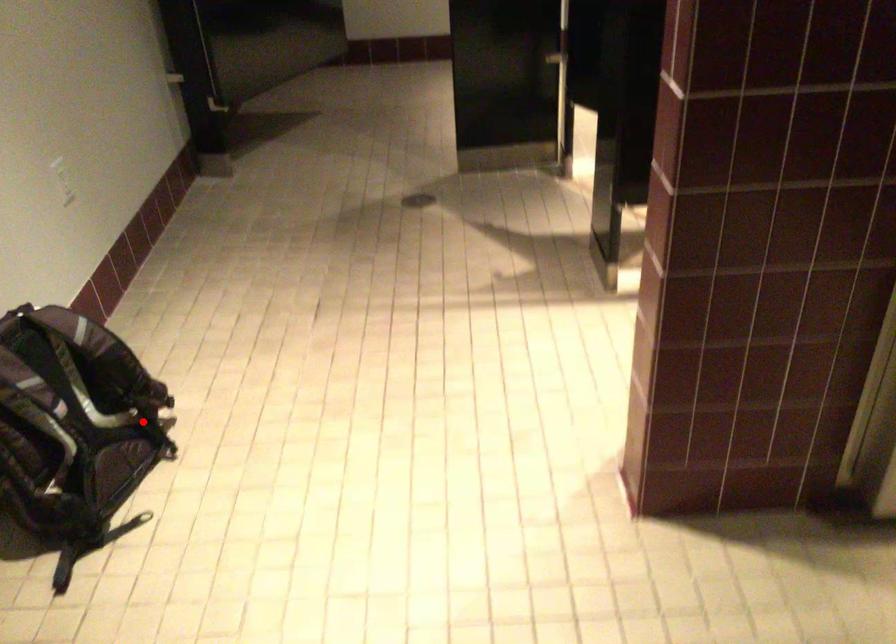
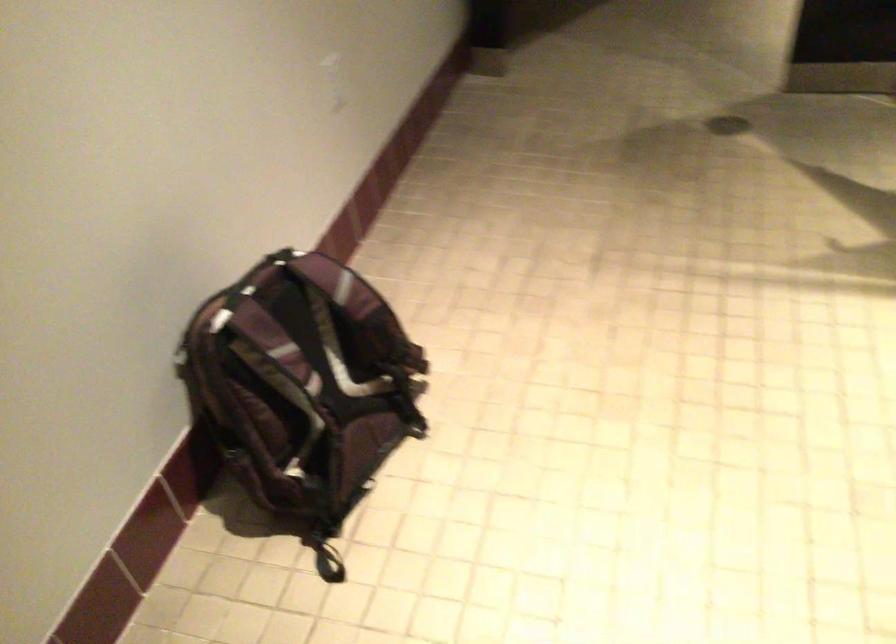
Where in the second image is the point corresponding to the highlighted location from the first image?

(393, 393)